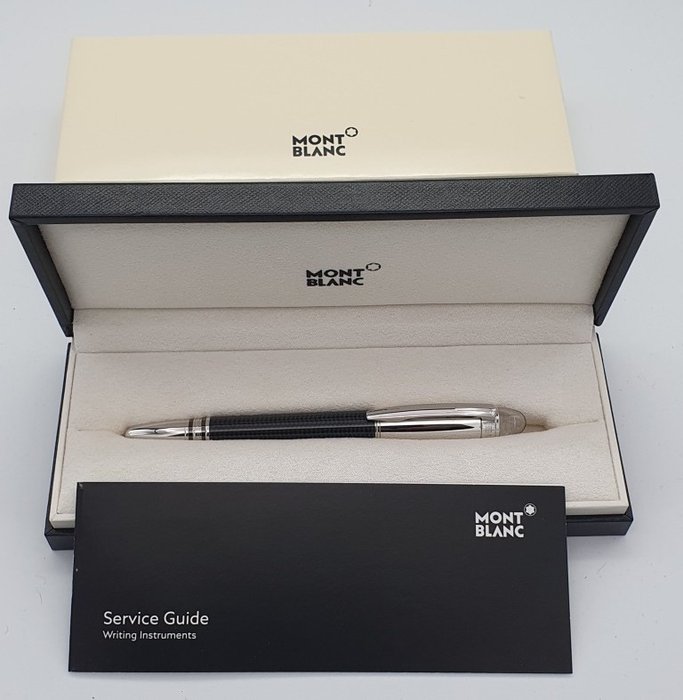
Locate an element on the screen. The image size is (683, 700). black rectangular pen case box is located at coordinates (622, 526), (52, 539).